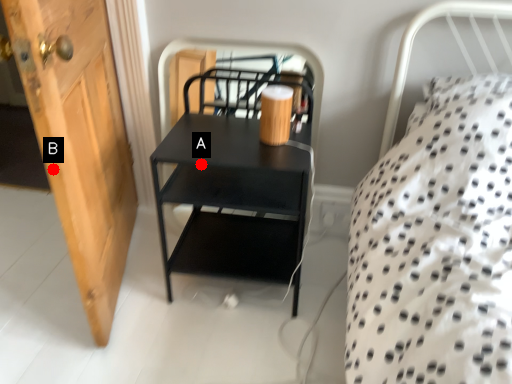
Question: Two points are circled on the image, labeled by A and B beside each circle. Which point is closer to the camera taking this photo?

Choices:
 (A) A is closer
 (B) B is closer

Answer: (B)